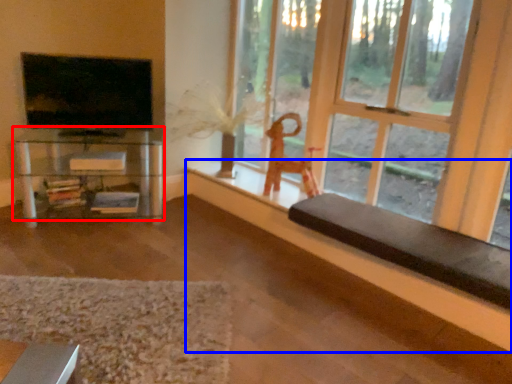
Question: Which object appears closest to the camera in this image, shelf (highlighted by a red box) or ledge (highlighted by a blue box)?

Choices:
 (A) shelf
 (B) ledge

Answer: (B)